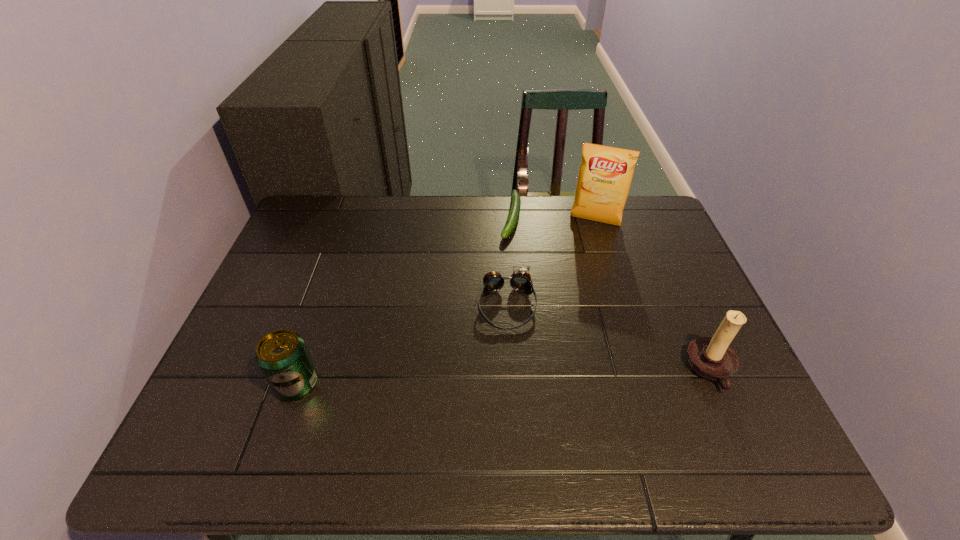
Identify the location of the leftmost object. (282, 356).

At what (x,y) coordinates should I click in order to perform the action: click on beer can. Please return your answer as a coordinate pair (x, y). Looking at the image, I should click on (282, 356).

Locate an element on the screen. the rightmost object is located at coordinates (710, 357).

Locate an element on the screen. The height and width of the screenshot is (540, 960). the fourth shortest object is located at coordinates (710, 357).

Where is `the fourth tallest object`? This screenshot has width=960, height=540. the fourth tallest object is located at coordinates (520, 280).

I want to click on the third farthest object, so click(520, 280).

Where is `zucchini`? zucchini is located at coordinates (513, 215).

This screenshot has height=540, width=960. Identify the location of the second object from right to left. (605, 175).

You are a GUI agent. You are given a task and a screenshot of the screen. Output one action in this format:
    pyautogui.click(x=<x>, y=<y>)
    Task: Click on the crisp (potato chip)
    The width and height of the screenshot is (960, 540).
    Given the screenshot: What is the action you would take?
    pyautogui.click(x=605, y=175)

The image size is (960, 540). I want to click on free point located 0.200m on the right of the beer can, so click(x=407, y=384).